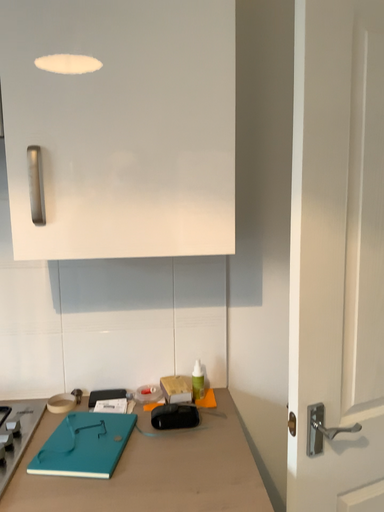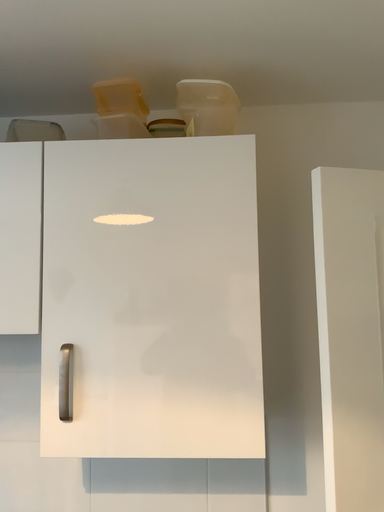
Question: Which way did the camera rotate in the video?

Choices:
 (A) rotated right
 (B) rotated left

Answer: (B)